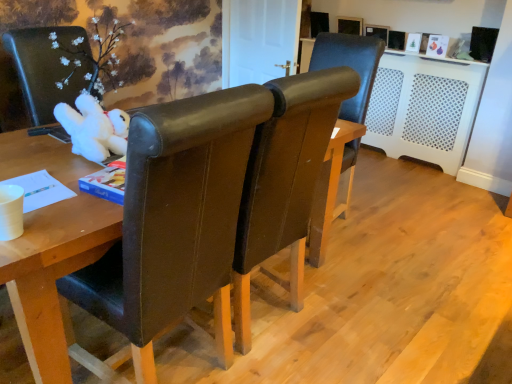
Question: Is brown leather chair at center, the third chair positioned from the front, at the right side of brown leather chair at center, the 3th chair positioned from the back?

Choices:
 (A) no
 (B) yes

Answer: (B)

Question: Considering the relative sizes of brown leather chair at center, the third chair positioned from the front, and brown leather chair at center, acting as the first chair starting from the front, in the image provided, is brown leather chair at center, the third chair positioned from the front, wider than brown leather chair at center, acting as the first chair starting from the front,?

Choices:
 (A) yes
 (B) no

Answer: (B)

Question: Can you confirm if brown leather chair at center, positioned as the first chair in back-to-front order, is taller than brown leather chair at center, acting as the first chair starting from the front?

Choices:
 (A) no
 (B) yes

Answer: (A)

Question: Could brown leather chair at center, the 3th chair positioned from the back, be considered to be inside brown leather chair at center, the third chair positioned from the front?

Choices:
 (A) no
 (B) yes

Answer: (A)

Question: From the image's perspective, is brown leather chair at center, positioned as the first chair in back-to-front order, located beneath brown leather chair at center, acting as the first chair starting from the front?

Choices:
 (A) no
 (B) yes

Answer: (A)

Question: From a real-world perspective, is brown leather chair at center, positioned as the first chair in back-to-front order, physically above brown leather chair at center, acting as the first chair starting from the front?

Choices:
 (A) no
 (B) yes

Answer: (A)

Question: Is brown leather chair at center, which is counted as the second chair, starting from the back, wider than brown leather chair at center, positioned as the first chair in back-to-front order?

Choices:
 (A) no
 (B) yes

Answer: (B)

Question: Is brown leather chair at center, which is counted as the 2th chair, starting from the front, looking in the opposite direction of brown leather chair at center, the third chair positioned from the front?

Choices:
 (A) no
 (B) yes

Answer: (A)

Question: Is brown leather chair at center, which is counted as the 2th chair, starting from the front, facing towards brown leather chair at center, the third chair positioned from the front?

Choices:
 (A) no
 (B) yes

Answer: (A)

Question: Is brown leather chair at center, which is counted as the second chair, starting from the back, at the right side of brown leather chair at center, the third chair positioned from the front?

Choices:
 (A) yes
 (B) no

Answer: (B)

Question: Can you confirm if brown leather chair at center, which is counted as the second chair, starting from the back, is thinner than brown leather chair at center, positioned as the first chair in back-to-front order?

Choices:
 (A) yes
 (B) no

Answer: (B)

Question: Can you confirm if brown leather chair at center, which is counted as the 2th chair, starting from the front, is bigger than brown leather chair at center, positioned as the first chair in back-to-front order?

Choices:
 (A) no
 (B) yes

Answer: (B)

Question: Is brown leather chair at center, the 3th chair positioned from the back, facing towards brown leather chair at center, positioned as the first chair in back-to-front order?

Choices:
 (A) no
 (B) yes

Answer: (A)